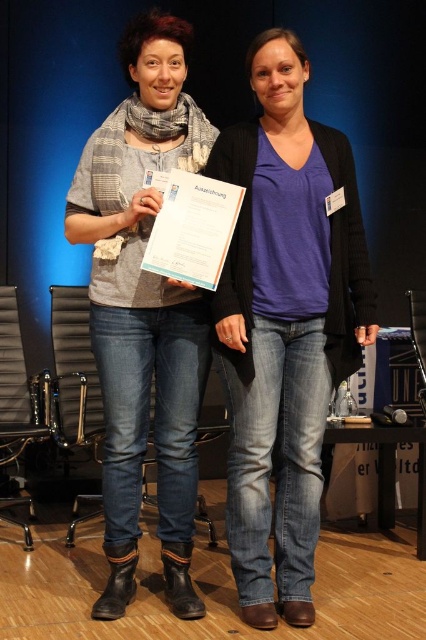
Does purple matte shirt at center have a larger size compared to matte gray scarf at center?

No, purple matte shirt at center is not bigger than matte gray scarf at center.

Describe the element at coordinates (284, 324) in the screenshot. I see `purple matte shirt at center` at that location.

Which is in front, point (256, 234) or point (187, 307)?

Point (256, 234) is more forward.

This screenshot has width=426, height=640. Identify the location of purple matte shirt at center. (284, 324).